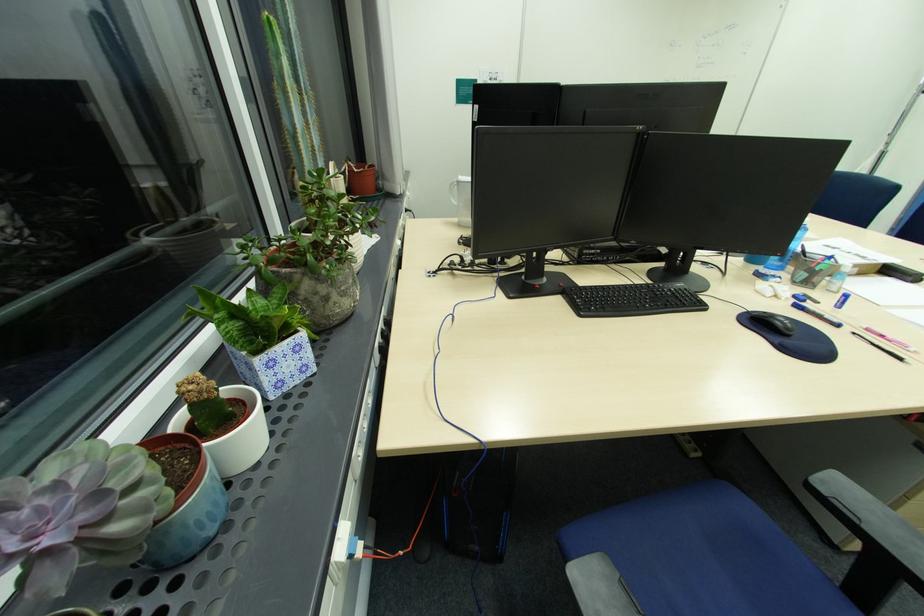
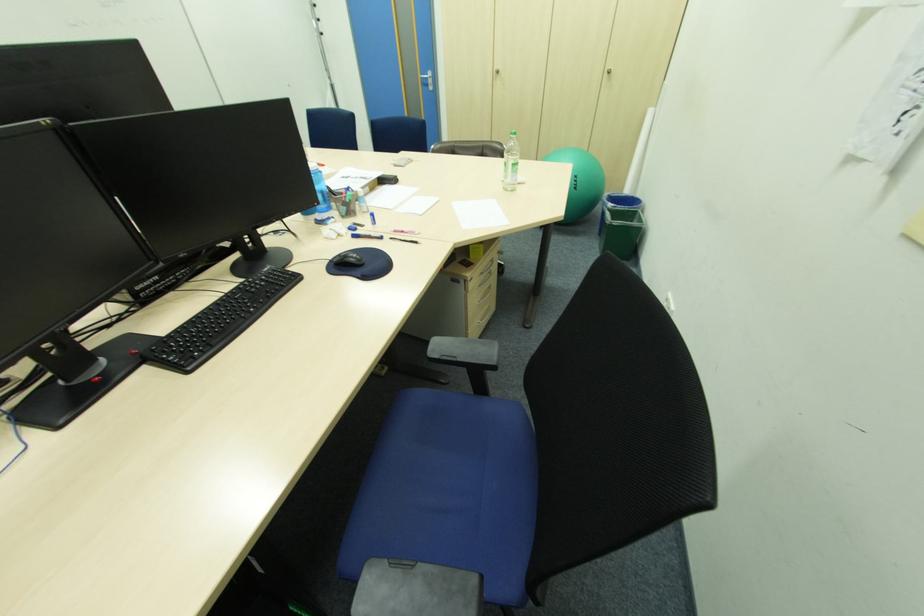
Find the pixel in the second image that matches the point at 784,323 in the first image.

(357, 260)